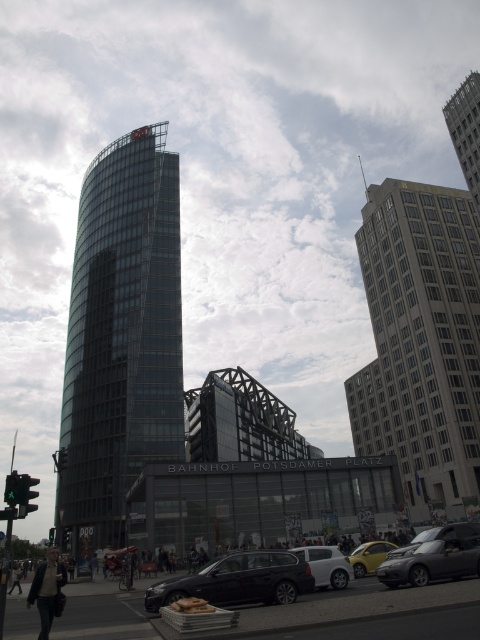
Question: Considering the real-world distances, which object is closest to the matte black car at center?

Choices:
 (A) glassy steel tower at center
 (B) shiny black car at lower center
 (C) shiny black car at lower right
 (D) green glass traffic light at center

Answer: (B)

Question: Observing the image, what is the correct spatial positioning of matte black car at center in reference to shiny black car at lower right?

Choices:
 (A) left
 (B) right

Answer: (A)

Question: Considering the relative positions of shiny black car at lower center and yellow matte car at lower center in the image provided, where is shiny black car at lower center located with respect to yellow matte car at lower center?

Choices:
 (A) above
 (B) below

Answer: (A)

Question: Among these points, which one is farthest from the camera?

Choices:
 (A) (316, 584)
 (B) (52, 541)
 (C) (154, 129)

Answer: (C)

Question: Which point is farther to the camera?

Choices:
 (A) (454, 104)
 (B) (243, 579)

Answer: (A)

Question: Can you confirm if shiny black car at lower right is bigger than green glass traffic light at center?

Choices:
 (A) yes
 (B) no

Answer: (B)